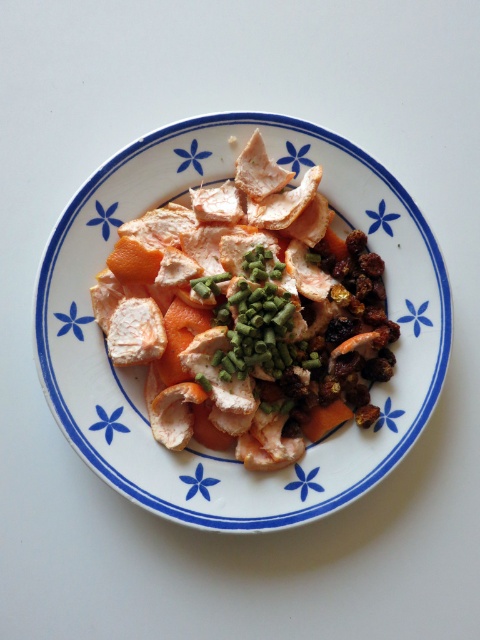
Does orange peel at center appear on the right side of green chopped onion at center?

In fact, orange peel at center is to the left of green chopped onion at center.

Can you confirm if orange peel at center is shorter than green chopped onion at center?

No, orange peel at center is not shorter than green chopped onion at center.

Who is more distant from viewer, (368, 252) or (243, 316)?

The point (368, 252) is behind.

Locate an element on the screen. orange peel at center is located at coordinates (248, 316).